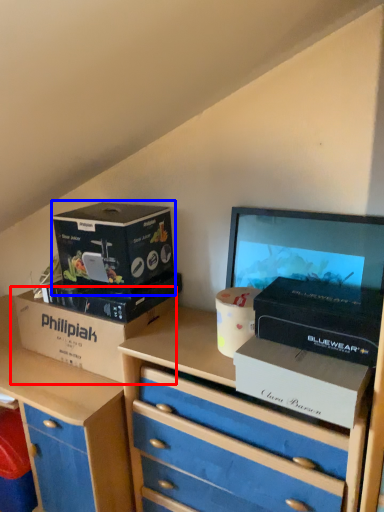
Question: Which object appears farthest to the camera in this image, box (highlighted by a red box) or box (highlighted by a blue box)?

Choices:
 (A) box
 (B) box

Answer: (A)